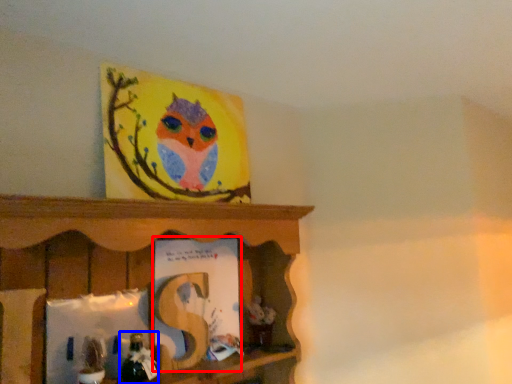
Question: Which point is closer to the camera, book (highlighted by a red box) or toy (highlighted by a blue box)?

Choices:
 (A) book
 (B) toy

Answer: (B)